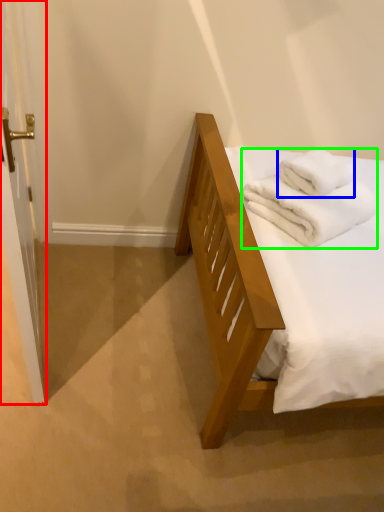
Question: Which object is the farthest from screen door (highlighted by a red box)? Choose among these: bath towel (highlighted by a blue box) or bath towel (highlighted by a green box).

Choices:
 (A) bath towel
 (B) bath towel

Answer: (A)